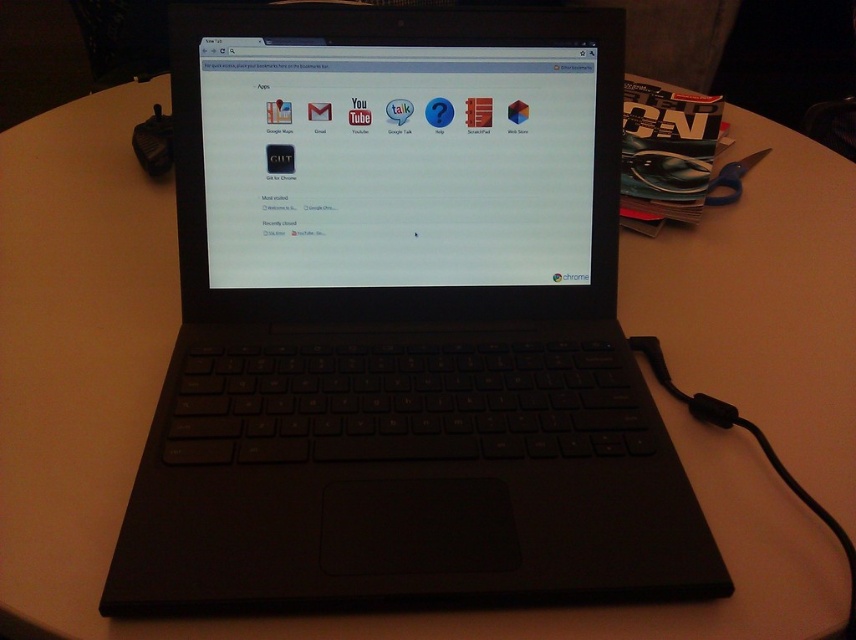
You are organizing a desk and want to stack the black matte laptop at center on top of the black plastic mouse at upper left. Is this possible based on their sizes?

The black matte laptop at center has a greater height compared to the black plastic mouse at upper left, so stacking the laptop on top of the mouse may be possible as long as the mouse provides a stable base. However, the mouse is smaller in size and might not support the laptop securely. It is not recommended due to potential instability.

You are a remote worker who needs to move your black plastic mouse at upper left closer to your hand while working on the black matte laptop at center. Since the mouse is currently behind the laptop, can you easily reach it without moving the laptop?

The black matte laptop at center is in front of the black plastic mouse at upper left, so the mouse is behind the laptop. You cannot easily reach it without moving the laptop.

You need to place both the black matte laptop at center and the black plastic mouse at upper left into a storage box. The box can only fit items up to the size of the larger object. Which object determines the minimum required size for the box?

The black matte laptop at center is larger in size than the black plastic mouse at upper left, so the box must be at least as large as the black matte laptop at center to accommodate both items.